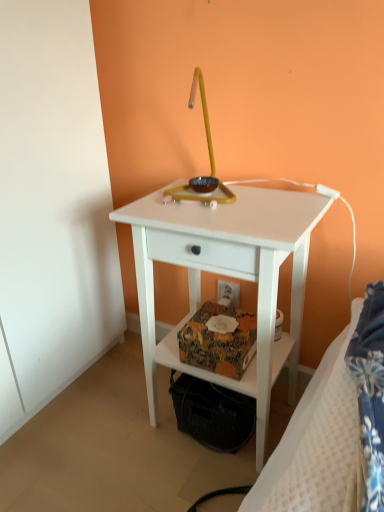
Question: Is white textured bed at lower right at the left side of white plastic electric outlet at lower center?

Choices:
 (A) yes
 (B) no

Answer: (B)

Question: Is white textured bed at lower right thinner than white plastic electric outlet at lower center?

Choices:
 (A) yes
 (B) no

Answer: (B)

Question: Are white textured bed at lower right and white plastic electric outlet at lower center making contact?

Choices:
 (A) no
 (B) yes

Answer: (A)

Question: Is white textured bed at lower right oriented away from white plastic electric outlet at lower center?

Choices:
 (A) no
 (B) yes

Answer: (A)

Question: From the image's perspective, would you say white textured bed at lower right is shown under white plastic electric outlet at lower center?

Choices:
 (A) yes
 (B) no

Answer: (A)

Question: Is white matte nightstand at center taller or shorter than white textured bed at lower right?

Choices:
 (A) short
 (B) tall

Answer: (B)

Question: In terms of size, does white matte nightstand at center appear bigger or smaller than white textured bed at lower right?

Choices:
 (A) small
 (B) big

Answer: (B)

Question: Do you think white matte nightstand at center is within white textured bed at lower right, or outside of it?

Choices:
 (A) inside
 (B) outside

Answer: (B)

Question: Is point (302, 305) positioned closer to the camera than point (379, 373)?

Choices:
 (A) farther
 (B) closer

Answer: (A)

Question: In the image, is white textured bed at lower right positioned in front of or behind white matte nightstand at center?

Choices:
 (A) behind
 (B) front

Answer: (B)

Question: From a real-world perspective, relative to white matte nightstand at center, is white textured bed at lower right vertically above or below?

Choices:
 (A) below
 (B) above

Answer: (B)

Question: Is white textured bed at lower right wider or thinner than white matte nightstand at center?

Choices:
 (A) wide
 (B) thin

Answer: (B)

Question: From their relative heights in the image, would you say white textured bed at lower right is taller or shorter than white matte nightstand at center?

Choices:
 (A) short
 (B) tall

Answer: (A)

Question: In the image, is white matte nightstand at center on the left side or the right side of white plastic electric outlet at lower center?

Choices:
 (A) right
 (B) left

Answer: (B)

Question: From a real-world perspective, is white matte nightstand at center positioned above or below white plastic electric outlet at lower center?

Choices:
 (A) above
 (B) below

Answer: (A)